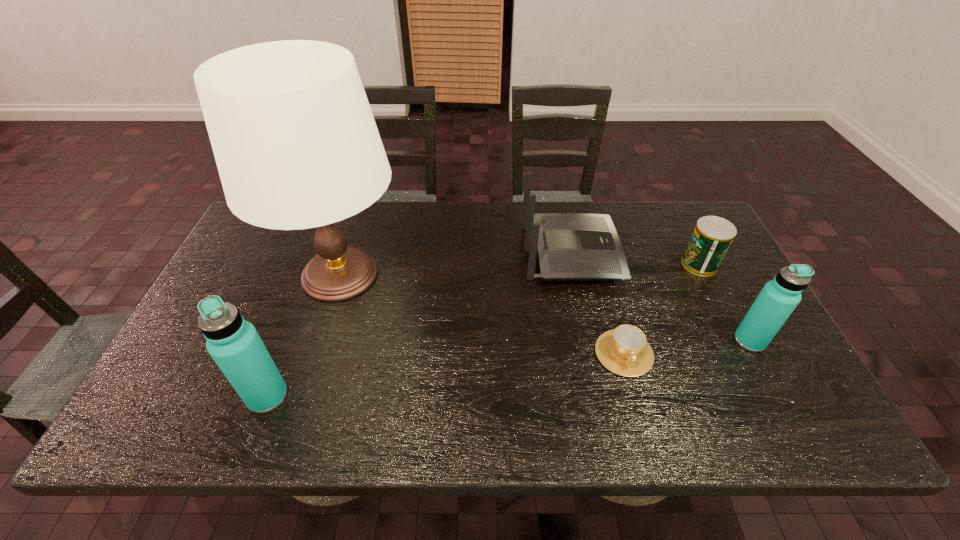
You are a GUI agent. You are given a task and a screenshot of the screen. Output one action in this format:
    pyautogui.click(x=<x>, y=<y>)
    Task: Click on the vacant area that lies between the cup and the left water bottle
    The image size is (960, 540).
    Given the screenshot: What is the action you would take?
    pyautogui.click(x=445, y=375)

The width and height of the screenshot is (960, 540). Find the location of `free point between the router and the shorter water bottle`. free point between the router and the shorter water bottle is located at coordinates (660, 297).

The height and width of the screenshot is (540, 960). In order to click on free spot between the fifth tallest object and the lamp in this screenshot , I will do `click(520, 269)`.

Where is `free spot between the tallest object and the nearest object`? Image resolution: width=960 pixels, height=540 pixels. free spot between the tallest object and the nearest object is located at coordinates (304, 335).

At what (x,y) coordinates should I click in order to perform the action: click on vacant area that lies between the lamp and the fourth tallest object. Please return your answer as a coordinate pair (x, y). Looking at the image, I should click on (456, 264).

Locate an element on the screen. This screenshot has height=540, width=960. vacant area that lies between the tallest object and the third shortest object is located at coordinates (456, 264).

Identify which object is the fourth nearest to the taller water bottle. Please provide its 2D coordinates. Your answer should be formatted as a tuple, i.e. [(x, y)], where the tuple contains the x and y coordinates of a point satisfying the conditions above.

[(779, 297)]

I want to click on the fourth closest object to the tallest object, so click(x=712, y=236).

Identify the location of blank space that satisfies the following two spatial constraints: 1. on the front side of the lamp; 2. on the right side of the right water bottle. This screenshot has height=540, width=960. (320, 341).

I want to click on free location that satisfies the following two spatial constraints: 1. on the back side of the can; 2. on the left side of the nearer water bottle, so click(x=318, y=265).